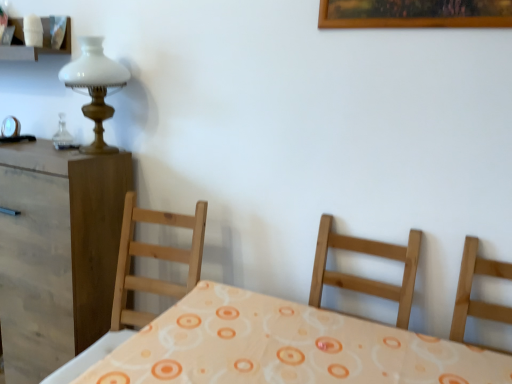
Question: Is light wood chair at right in front of white matte shelf at upper left?

Choices:
 (A) yes
 (B) no

Answer: (A)

Question: Would you say light wood chair at right is outside white matte shelf at upper left?

Choices:
 (A) no
 (B) yes

Answer: (B)

Question: From the image's perspective, is light wood chair at right located beneath white matte shelf at upper left?

Choices:
 (A) yes
 (B) no

Answer: (A)

Question: Is the position of light wood chair at right more distant than that of white matte shelf at upper left?

Choices:
 (A) yes
 (B) no

Answer: (B)

Question: Can you confirm if light wood chair at right is wider than white matte shelf at upper left?

Choices:
 (A) no
 (B) yes

Answer: (B)

Question: Is light wood chair at right to the right of white matte shelf at upper left from the viewer's perspective?

Choices:
 (A) no
 (B) yes

Answer: (B)

Question: Would you consider light wood chair at right to be distant from brown wood nightstand at left?

Choices:
 (A) no
 (B) yes

Answer: (B)

Question: From the image's perspective, is light wood chair at right beneath brown wood nightstand at left?

Choices:
 (A) yes
 (B) no

Answer: (A)

Question: Is light wood chair at right at the left side of brown wood nightstand at left?

Choices:
 (A) yes
 (B) no

Answer: (B)

Question: Considering the relative sizes of light wood chair at right and brown wood nightstand at left in the image provided, is light wood chair at right smaller than brown wood nightstand at left?

Choices:
 (A) no
 (B) yes

Answer: (B)

Question: Can you confirm if light wood chair at right is taller than brown wood nightstand at left?

Choices:
 (A) no
 (B) yes

Answer: (A)

Question: Is light wood chair at right oriented towards brown wood nightstand at left?

Choices:
 (A) no
 (B) yes

Answer: (A)

Question: Would you consider white glass lamp at upper left to be distant from white matte shelf at upper left?

Choices:
 (A) yes
 (B) no

Answer: (B)